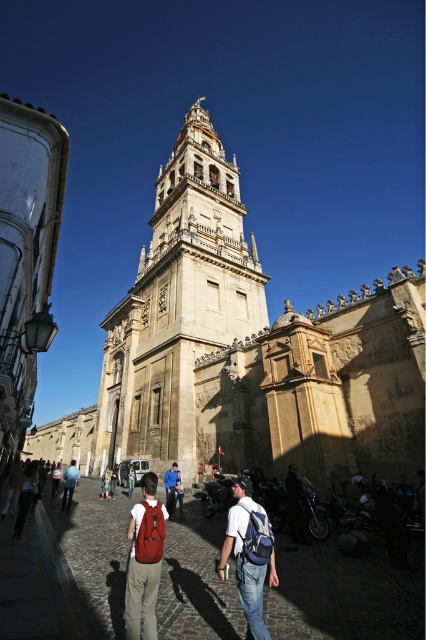
Question: Is brown stone tower at center closer to camera compared to matte brown backpack at center?

Choices:
 (A) yes
 (B) no

Answer: (B)

Question: Where is brown stone tower at center located in relation to denim jacket at center in the image?

Choices:
 (A) below
 (B) above

Answer: (B)

Question: Can you confirm if beige stone church at center is bigger than matte brown backpack at center?

Choices:
 (A) no
 (B) yes

Answer: (B)

Question: Among these objects, which one is nearest to the camera?

Choices:
 (A) denim jacket at center
 (B) matte brown backpack at center

Answer: (B)

Question: Estimate the real-world distances between objects in this image. Which object is farther from the brown stone tower at center?

Choices:
 (A) beige stone church at center
 (B) denim jacket at center
 (C) light brown leather jacket at center
 (D) denim backpack at center

Answer: (D)

Question: Which is farther from the brown stone tower at center?

Choices:
 (A) denim backpack at center
 (B) denim jacket at center

Answer: (A)